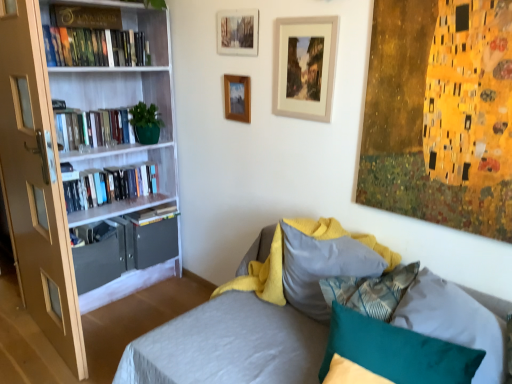
Identify the location of free space in front of white glossy bookcase at left. This screenshot has height=384, width=512. (93, 335).